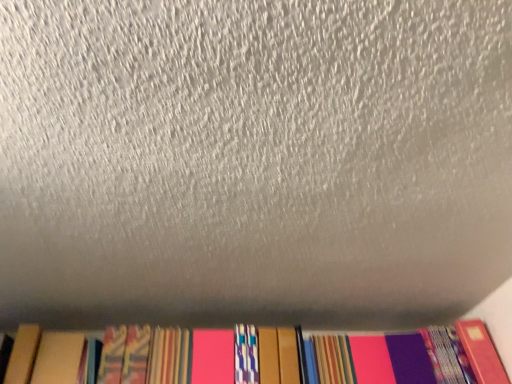
What do you see at coordinates (23, 354) in the screenshot?
I see `hardcover book at bottom left` at bounding box center [23, 354].

Find the location of a particular element. The height and width of the screenshot is (384, 512). hardcover book at bottom left is located at coordinates (23, 354).

The width and height of the screenshot is (512, 384). Identify the location of hardcover book at bottom left. (23, 354).